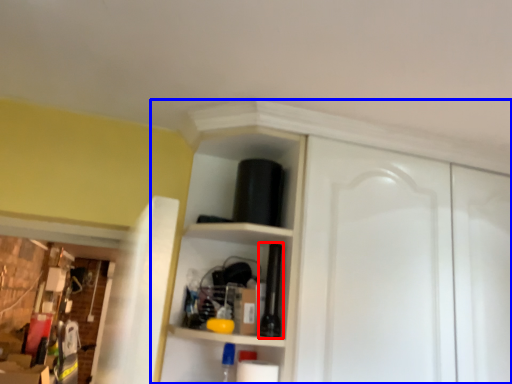
Question: Which of the following is the farthest to the observer, bottle (highlighted by a red box) or dresser (highlighted by a blue box)?

Choices:
 (A) bottle
 (B) dresser

Answer: (A)